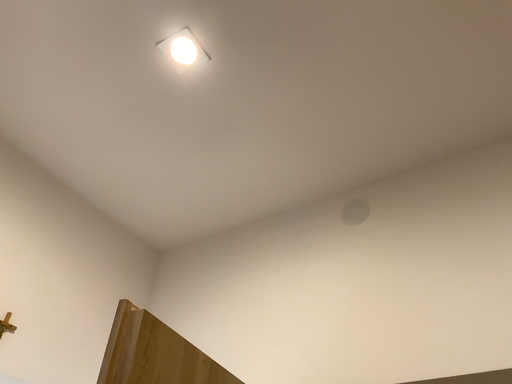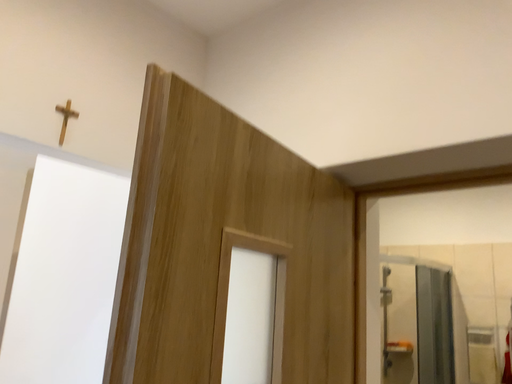
Question: How did the camera likely rotate when shooting the video?

Choices:
 (A) rotated upward
 (B) rotated downward

Answer: (B)